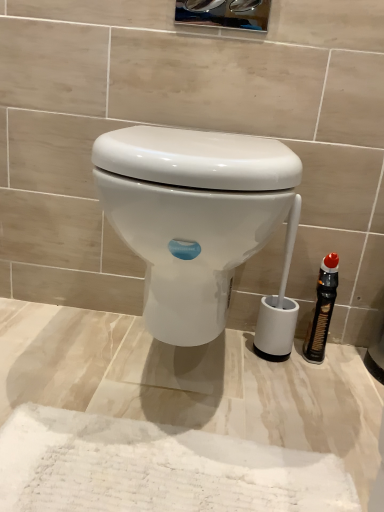
In order to click on white glossy toilet at center in this screenshot , I will do `click(195, 217)`.

Image resolution: width=384 pixels, height=512 pixels. What do you see at coordinates (195, 217) in the screenshot? I see `white glossy toilet at center` at bounding box center [195, 217].

Measure the distance between point (323,274) and camera.

They are 1.03 meters apart.

The height and width of the screenshot is (512, 384). Describe the element at coordinates (322, 309) in the screenshot. I see `black plastic bottle at right` at that location.

Locate an element on the screen. black plastic bottle at right is located at coordinates (322, 309).

Where is `white glossy toilet at center`? white glossy toilet at center is located at coordinates (195, 217).

Considering the relative positions of white glossy toilet at center and black plastic bottle at right in the image provided, is white glossy toilet at center to the left or to the right of black plastic bottle at right?

Clearly, white glossy toilet at center is on the left of black plastic bottle at right in the image.

Is white glossy toilet at center closer to the viewer compared to black plastic bottle at right?

Yes, white glossy toilet at center is closer to the viewer.

Considering the points (197, 286) and (336, 264), which point is behind, point (197, 286) or point (336, 264)?

The point (336, 264) is farther.

From the image's perspective, would you say white glossy toilet at center is positioned over black plastic bottle at right?

Yes, from the image's perspective, white glossy toilet at center is over black plastic bottle at right.

In the scene shown: From a real-world perspective, is white glossy toilet at center positioned above or below black plastic bottle at right?

From a real-world perspective, white glossy toilet at center is physically above black plastic bottle at right.

Looking at their sizes, would you say white glossy toilet at center is wider or thinner than black plastic bottle at right?

Considering their sizes, white glossy toilet at center looks broader than black plastic bottle at right.

Is white glossy toilet at center shorter than black plastic bottle at right?

No.

Can you confirm if white glossy toilet at center is bigger than black plastic bottle at right?

Correct, white glossy toilet at center is larger in size than black plastic bottle at right.

Could black plastic bottle at right be considered to be inside white glossy toilet at center?

No, black plastic bottle at right is not surrounded by white glossy toilet at center.

Is white glossy toilet at center not near black plastic bottle at right?

No.

Is black plastic bottle at right at the back of white glossy toilet at center?

That's not correct — white glossy toilet at center is not looking away from black plastic bottle at right.

How far apart are white glossy toilet at center and black plastic bottle at right?

white glossy toilet at center and black plastic bottle at right are 17.79 inches apart from each other.

Locate an element on the screen. This screenshot has width=384, height=512. bottle below the white glossy toilet at center (from the image's perspective) is located at coordinates (322, 309).

Considering the positions of objects black plastic bottle at right and white glossy toilet at center in the image provided, who is more to the left, black plastic bottle at right or white glossy toilet at center?

From the viewer's perspective, white glossy toilet at center appears more on the left side.

In the image, is black plastic bottle at right positioned in front of or behind white glossy toilet at center?

Visually, black plastic bottle at right is located behind white glossy toilet at center.

Is point (332, 258) closer to viewer compared to point (260, 202)?

No, (332, 258) is further to viewer.

From the image's perspective, which is below, black plastic bottle at right or white glossy toilet at center?

From the image's view, black plastic bottle at right is below.

From a real-world perspective, which object rests below the other?

black plastic bottle at right, from a real-world perspective.

Considering the relative sizes of black plastic bottle at right and white glossy toilet at center in the image provided, is black plastic bottle at right thinner than white glossy toilet at center?

Yes.

Who is taller, black plastic bottle at right or white glossy toilet at center?

white glossy toilet at center.

Does black plastic bottle at right have a smaller size compared to white glossy toilet at center?

Correct, black plastic bottle at right occupies less space than white glossy toilet at center.

From the picture: Would you say black plastic bottle at right is inside or outside white glossy toilet at center?

black plastic bottle at right is not enclosed by white glossy toilet at center.

Would you consider black plastic bottle at right to be distant from white glossy toilet at center?

They are positioned close to each other.

Is black plastic bottle at right facing away from white glossy toilet at center?

No, black plastic bottle at right is not facing the opposite direction of white glossy toilet at center.

How many degrees apart are the facing directions of black plastic bottle at right and white glossy toilet at center?

8.51 degrees.

Measure the distance from black plastic bottle at right to white glossy toilet at center.

black plastic bottle at right and white glossy toilet at center are 17.79 inches apart.

Identify the location of bottle that is under the white glossy toilet at center (from a real-world perspective). (322, 309).

This screenshot has width=384, height=512. In order to click on bottle behind the white glossy toilet at center in this screenshot , I will do `click(322, 309)`.

At what (x,y) coordinates should I click in order to perform the action: click on bottle below the white glossy toilet at center (from a real-world perspective). Please return your answer as a coordinate pair (x, y). Looking at the image, I should click on (322, 309).